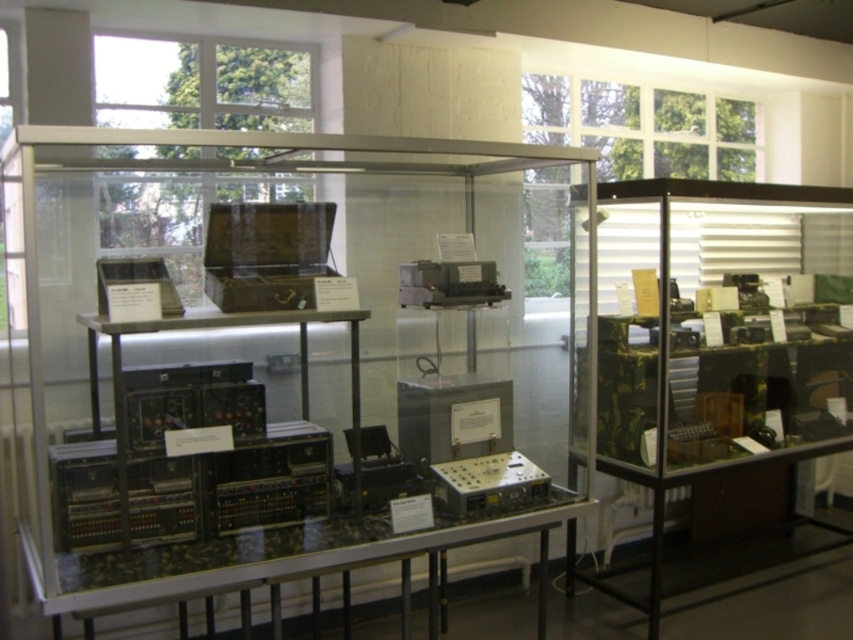
You are a museum security guard who needs to move a 3.5 feet wide security barrier between the clear acrylic glass box at center and the camouflage fabric electronics at right. Can the barrier fit between them without touching either object?

The distance between the clear acrylic glass box at center and the camouflage fabric electronics at right is 3.34 feet. Since the security barrier is 3.5 feet wide, it cannot fit between them as the barrier is wider than the available space.

You are a museum visitor standing in front of the glass cabinets. You notice the camouflage fabric electronics at right and the metallic silver electronic device at center. Which one is placed higher?

The camouflage fabric electronics at right is positioned over the metallic silver electronic device at center, so it is placed higher.